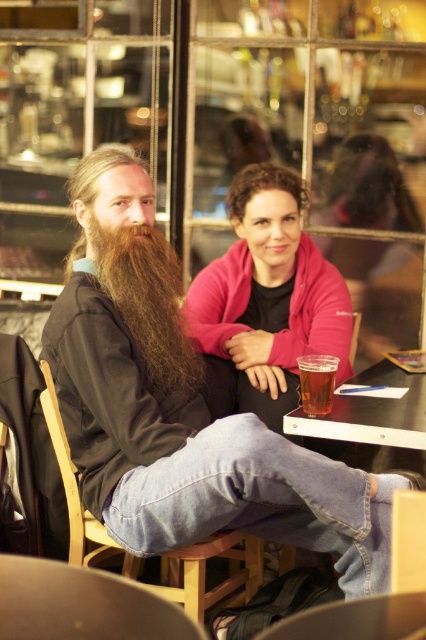
You are a photographer setting up a shot in this scene. You want to ensure the long brown hair at left and the wooden chair at lower left are both in focus. Since the camera can only focus on one subject at a time, which object should you focus on to ensure the other is also in focus due to their proximity?

Result: You should focus on the wooden chair at lower left because the long brown hair at left is positioned on the right side of wooden chair at lower left, meaning they are close enough for the camera to capture both in focus if focused on the chair.

You are standing at the entrance of the cafe and see two points marked on the floor. The first point is at coordinate point(137, 323) and the second point is at coordinate point(233, 548). If you want to walk towards the point that is closer to the entrance, which coordinate should you head towards?

Point(137, 323) is in front of point(233, 548), so you should head towards point(137, 323) as it is closer to the entrance.

You are a photographer trying to capture a group photo of the long brown hair at left and the wooden chair at lower left. Since you want to ensure both subjects are clearly visible, which one should you focus on first considering their sizes?

The long brown hair at left has a smaller size compared to the wooden chair at lower left, so you should focus on the wooden chair at lower left first to ensure proper exposure and sharpness for the larger subject.